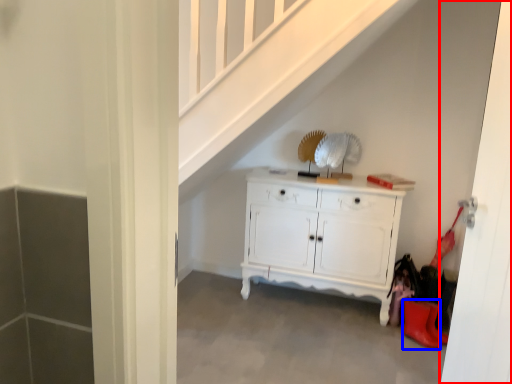
Question: Among these objects, which one is farthest to the camera, door (highlighted by a red box) or shoe (highlighted by a blue box)?

Choices:
 (A) door
 (B) shoe

Answer: (B)